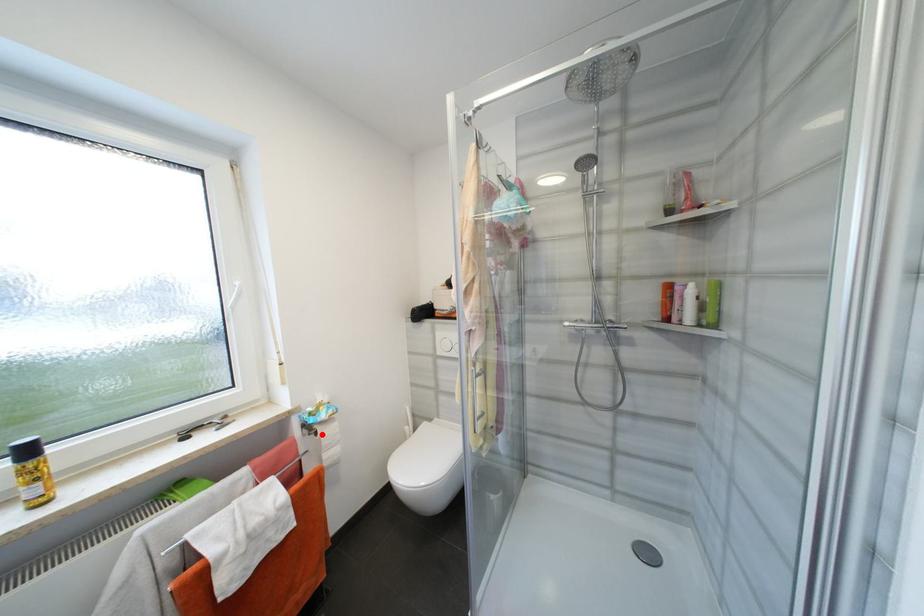
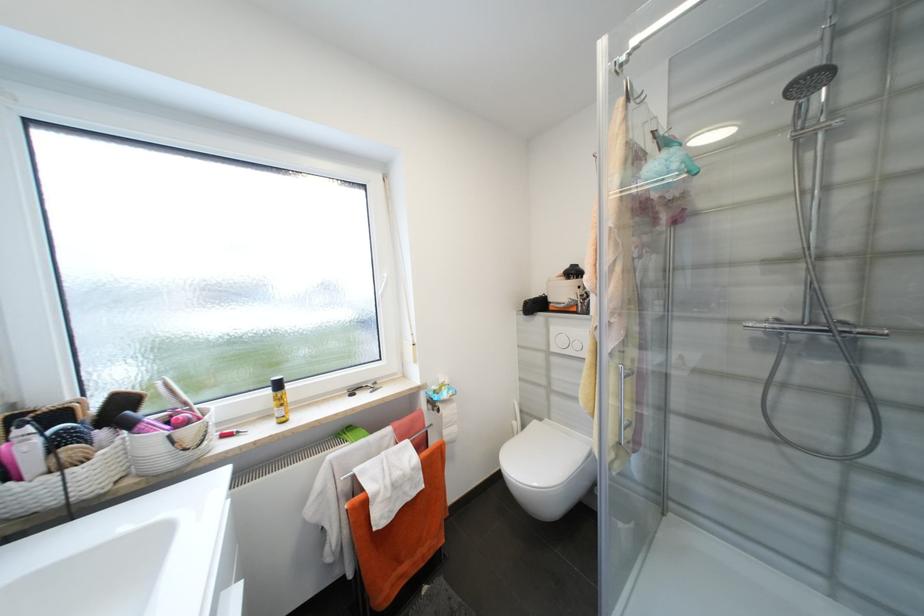
Locate, in the second image, the point that corresponds to the highlighted location in the first image.

(444, 411)